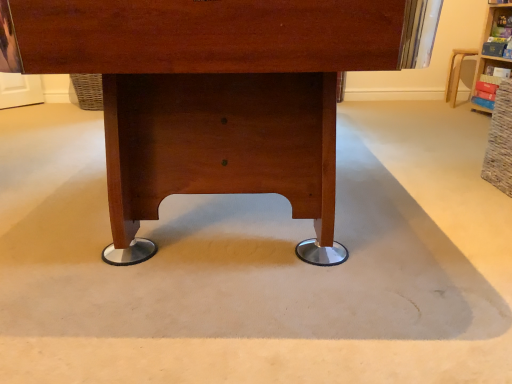
Describe the element at coordinates (217, 94) in the screenshot. I see `wooden desk at center` at that location.

Identify the location of wooden desk at center. (217, 94).

Locate an element on the screen. wooden desk at center is located at coordinates (217, 94).